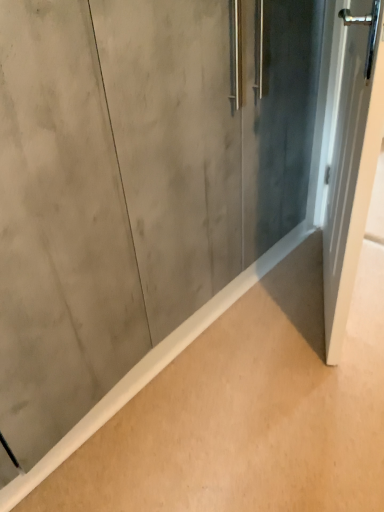
Where is `white glossy door at right`? Image resolution: width=384 pixels, height=512 pixels. white glossy door at right is located at coordinates (352, 162).

What do you see at coordinates (352, 162) in the screenshot?
I see `white glossy door at right` at bounding box center [352, 162].

What is the approximate height of white glossy door at right?

The height of white glossy door at right is 37.20 inches.

Find the location of a particular element. The width and height of the screenshot is (384, 512). white glossy door at right is located at coordinates (352, 162).